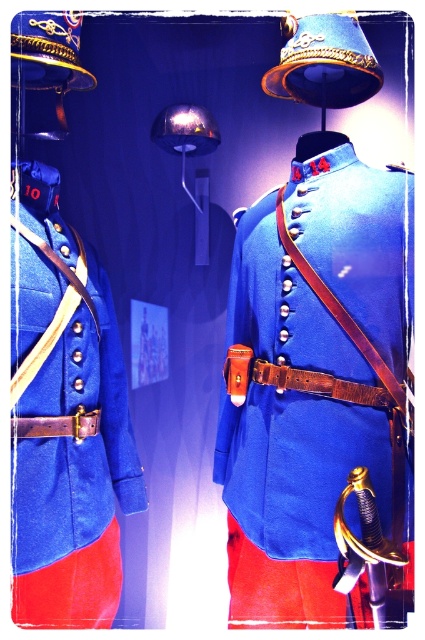
You are an assistant helping to arrange these historical mannequins. You need to place a small decorative flag between the blue woolen coat at center and the matte blue fabric jacket at left. Since the flag needs to be placed at the same height as the taller item, where should you position it?

The blue woolen coat at center is taller than the matte blue fabric jacket at left. Therefore, you should position the flag at the height of the blue woolen coat at center.

You are a historian standing 1 meter away from a display case containing a blue woolen coat at center. Can you reach out and touch the coat without moving closer?

The blue woolen coat at center is 98.42 centimeters away from viewer, so yes, you can reach out and touch the coat without moving closer since it is within arm

Looking at this image, what is the color of the fabric at the coordinates point (65, 419)?

The point (65, 419) indicates matte blue fabric jacket at left.